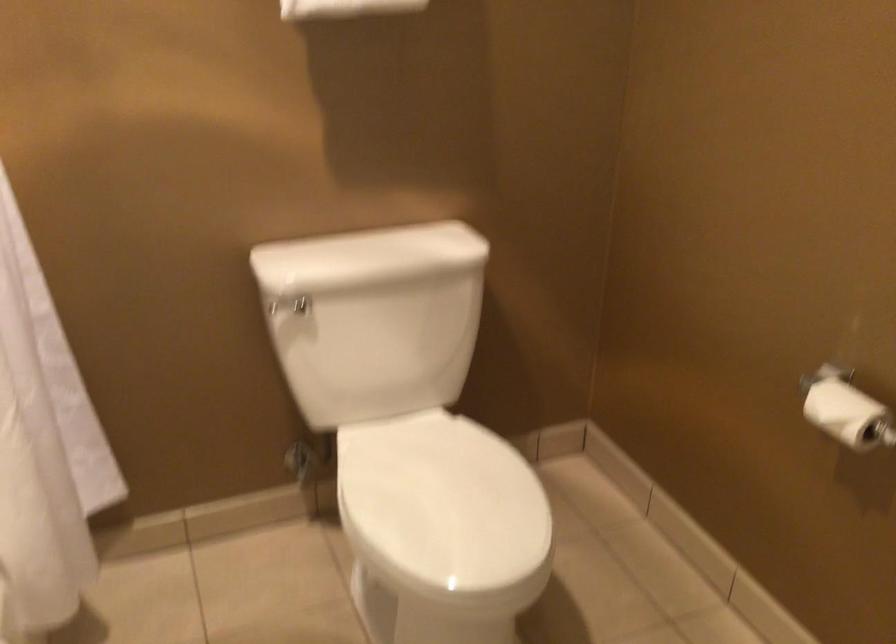
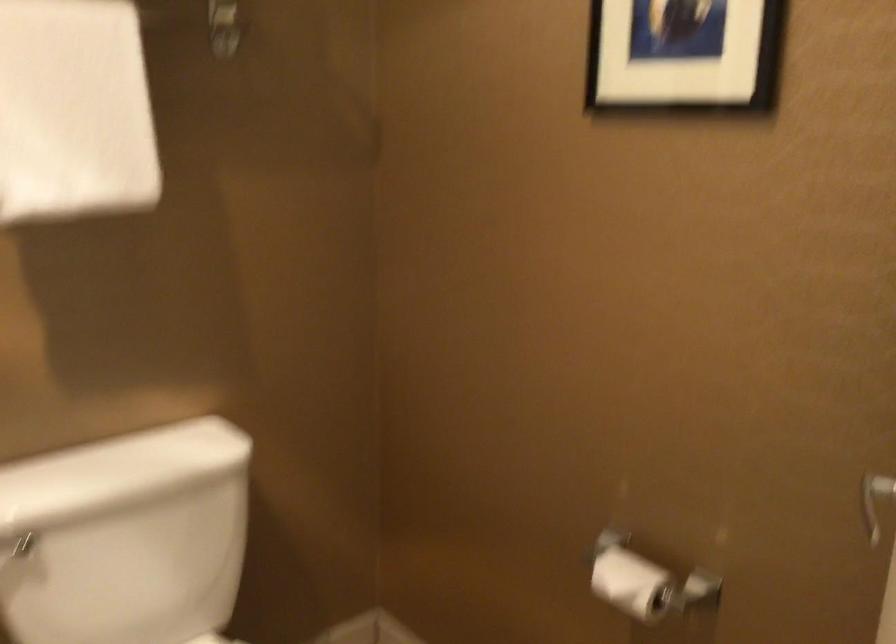
Question: The images are taken continuously from a first-person perspective. In which direction are you moving?

Choices:
 (A) Left
 (B) Right
 (C) Forward
 (D) Backward

Answer: (C)